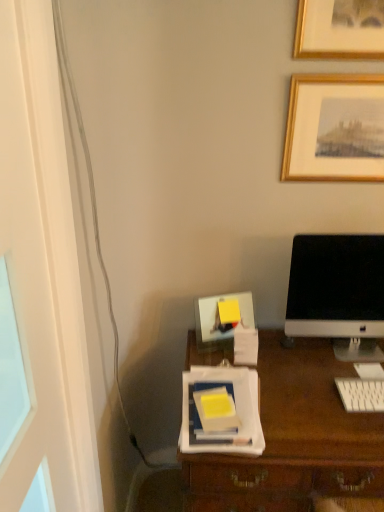
What do you see at coordinates (44, 265) in the screenshot? The width and height of the screenshot is (384, 512). I see `transparent glass door at left` at bounding box center [44, 265].

The width and height of the screenshot is (384, 512). Find the location of `white glossy computer monitor at right`. white glossy computer monitor at right is located at coordinates (338, 293).

Find the location of `yellow matte notebook at center`. yellow matte notebook at center is located at coordinates (216, 410).

Locate an element on the screen. The image size is (384, 512). transparent glass door at left is located at coordinates (44, 265).

You are a GUI agent. You are given a task and a screenshot of the screen. Output one action in this format:
    pyautogui.click(x=<x>, y=<y>)
    Task: Click on the glass door that is on the left side of gold wooden picture frame at upper right
    
    Given the screenshot: What is the action you would take?
    coord(44,265)

Considering the positions of objects transparent glass door at left and gold wooden picture frame at upper right in the image provided, who is in front, transparent glass door at left or gold wooden picture frame at upper right?

transparent glass door at left is more forward.

From the image's perspective, is transparent glass door at left positioned above or below gold wooden picture frame at upper right?

Based on their image positions, transparent glass door at left is located beneath gold wooden picture frame at upper right.

Is transparent glass door at left facing away from gold wooden picture frame at upper right?

No, transparent glass door at left is not facing the opposite direction of gold wooden picture frame at upper right.

Does point (379, 136) come behind point (356, 406)?

Yes, it is.

Relative to white plastic keyboard at lower right, is gold wooden picture frame at upper right in front or behind?

Clearly, gold wooden picture frame at upper right is behind white plastic keyboard at lower right.

Is gold wooden picture frame at upper right not near white plastic keyboard at lower right?

No.

From the image's perspective, between gold wooden picture frame at upper right and white plastic keyboard at lower right, who is located below?

white plastic keyboard at lower right, from the image's perspective.

Is white plastic keyboard at lower right thinner than white glossy computer monitor at right?

In fact, white plastic keyboard at lower right might be wider than white glossy computer monitor at right.

Does point (354, 397) come behind point (302, 243)?

That is False.

Is white plastic keyboard at lower right inside the boundaries of white glossy computer monitor at right, or outside?

white plastic keyboard at lower right is located beyond the bounds of white glossy computer monitor at right.

Is white plastic keyboard at lower right beside white glossy computer monitor at right?

No, white plastic keyboard at lower right is not touching white glossy computer monitor at right.

Is yellow matte notebook at center in contact with white glossy computer monitor at right?

There is a gap between yellow matte notebook at center and white glossy computer monitor at right.

Between yellow matte notebook at center and white glossy computer monitor at right, which one is positioned in front?

yellow matte notebook at center is more forward.

Is yellow matte notebook at center turned away from white glossy computer monitor at right?

No, yellow matte notebook at center is not facing away from white glossy computer monitor at right.

From the image's perspective, between yellow matte notebook at center and white glossy computer monitor at right, who is located below?

yellow matte notebook at center is shown below in the image.

Who is taller, white glossy computer monitor at right or yellow matte notebook at center?

Standing taller between the two is white glossy computer monitor at right.

Identify the location of notebook below the white glossy computer monitor at right (from the image's perspective). click(216, 410).

Between white glossy computer monitor at right and yellow matte notebook at center, which one has smaller size?

Smaller between the two is yellow matte notebook at center.

What's the angular difference between yellow matte notebook at center and transparent glass door at left's facing directions?

The facing directions of yellow matte notebook at center and transparent glass door at left are 88.1 degrees apart.

Considering their positions, is yellow matte notebook at center located in front of or behind transparent glass door at left?

Visually, yellow matte notebook at center is located behind transparent glass door at left.

From a real-world perspective, which is physically above, yellow matte notebook at center or transparent glass door at left?

In real-world perspective, transparent glass door at left is above.

Considering the positions of points (221, 411) and (49, 444), is point (221, 411) farther from camera compared to point (49, 444)?

Yes, it is behind point (49, 444).

From the image's perspective, is white plastic keyboard at lower right beneath yellow matte notebook at center?

Yes, from the image's perspective, white plastic keyboard at lower right is beneath yellow matte notebook at center.

Which object is further away from the camera taking this photo, white plastic keyboard at lower right or yellow matte notebook at center?

white plastic keyboard at lower right.

Does white plastic keyboard at lower right touch yellow matte notebook at center?

No, white plastic keyboard at lower right is not beside yellow matte notebook at center.

Considering the points (363, 403) and (212, 421), which point is in front, point (363, 403) or point (212, 421)?

The point (212, 421) is more forward.

Find the location of a particular element. Image resolution: width=384 pixels, height=512 pixels. glass door that appears in front of the gold wooden picture frame at upper right is located at coordinates (44, 265).

Locate an element on the screen. The height and width of the screenshot is (512, 384). picture frame above the white plastic keyboard at lower right (from the image's perspective) is located at coordinates click(x=335, y=128).

Based on their spatial positions, is gold wooden picture frame at upper right or white glossy computer monitor at right further from yellow matte notebook at center?

Based on the image, gold wooden picture frame at upper right appears to be further to yellow matte notebook at center.

Estimate the real-world distances between objects in this image. Which object is further from gold wooden picture frame at upper right, white plastic keyboard at lower right or transparent glass door at left?

transparent glass door at left is positioned further to the anchor gold wooden picture frame at upper right.

Estimate the real-world distances between objects in this image. Which object is closer to white plastic keyboard at lower right, yellow matte notebook at center or white glossy computer monitor at right?

Among the two, white glossy computer monitor at right is located nearer to white plastic keyboard at lower right.

Based on their spatial positions, is white plastic keyboard at lower right or transparent glass door at left further from white glossy computer monitor at right?

Among the two, transparent glass door at left is located further to white glossy computer monitor at right.

Considering their positions, is white glossy computer monitor at right positioned closer to gold wooden picture frame at upper right than yellow matte notebook at center?

white glossy computer monitor at right lies closer to gold wooden picture frame at upper right than the other object.

Which object lies further to the anchor point transparent glass door at left, white glossy computer monitor at right or white plastic keyboard at lower right?

The object further to transparent glass door at left is white plastic keyboard at lower right.

Which object lies further to the anchor point transparent glass door at left, white glossy computer monitor at right or gold wooden picture frame at upper right?

The object further to transparent glass door at left is gold wooden picture frame at upper right.

From the image, which object appears to be nearer to gold wooden picture frame at upper right, white glossy computer monitor at right or transparent glass door at left?

white glossy computer monitor at right is closer to gold wooden picture frame at upper right.

Locate an element on the screen. notebook located between transparent glass door at left and white plastic keyboard at lower right in the depth direction is located at coordinates (216, 410).

Locate an element on the screen. The height and width of the screenshot is (512, 384). computer monitor between gold wooden picture frame at upper right and yellow matte notebook at center vertically is located at coordinates (338, 293).

You are a GUI agent. You are given a task and a screenshot of the screen. Output one action in this format:
    pyautogui.click(x=<x>, y=<y>)
    Task: Click on the computer monitor between transparent glass door at left and gold wooden picture frame at upper right from front to back
    
    Given the screenshot: What is the action you would take?
    pyautogui.click(x=338, y=293)

The height and width of the screenshot is (512, 384). What are the coordinates of `computer monitor between yellow matte notebook at center and white plastic keyboard at lower right` in the screenshot? It's located at (338, 293).